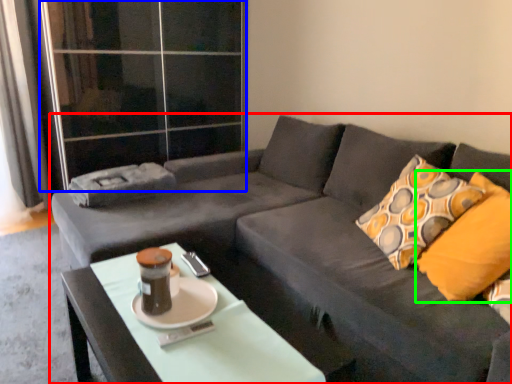
Question: Which is farther away from studio couch (highlighted by a red box)? glass door (highlighted by a blue box) or throw pillow (highlighted by a green box)?

Choices:
 (A) glass door
 (B) throw pillow

Answer: (A)